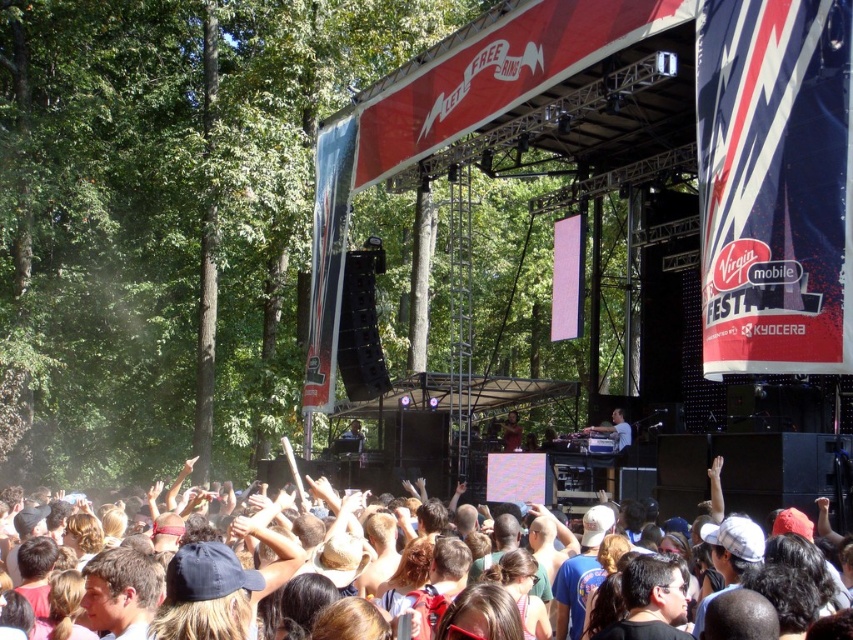
You are a photographer at the Virgin Mobile Festival. You want to capture a photo that includes both the multicolored fabric crowd at lower center and the shiny black jacket at center. Based on their heights, which object should you focus on first to ensure both are in frame?

The multicolored fabric crowd at lower center is taller than the shiny black jacket at center, so you should focus on the multicolored fabric crowd at lower center first to ensure both are in frame.

You are a photographer at the Virgin Mobile Festival. You want to capture a photo that includes both the multicolored fabric crowd at lower center and the shiny black jacket at center. Which object should you position closer to the left side of your camera frame?

The multicolored fabric crowd at lower center should be positioned closer to the left side of your camera frame because it is located to the left of the shiny black jacket at center.

You are at the concert and want to take a photo of the shiny black jacket at center and the matte black dj booth at center. Which object should you focus on first if you want to capture both in one shot without moving your camera?

You should focus on the shiny black jacket at center first because the matte black dj booth at center is to the right of it, so by centering the jacket and adjusting the zoom, both objects can be included in the frame.